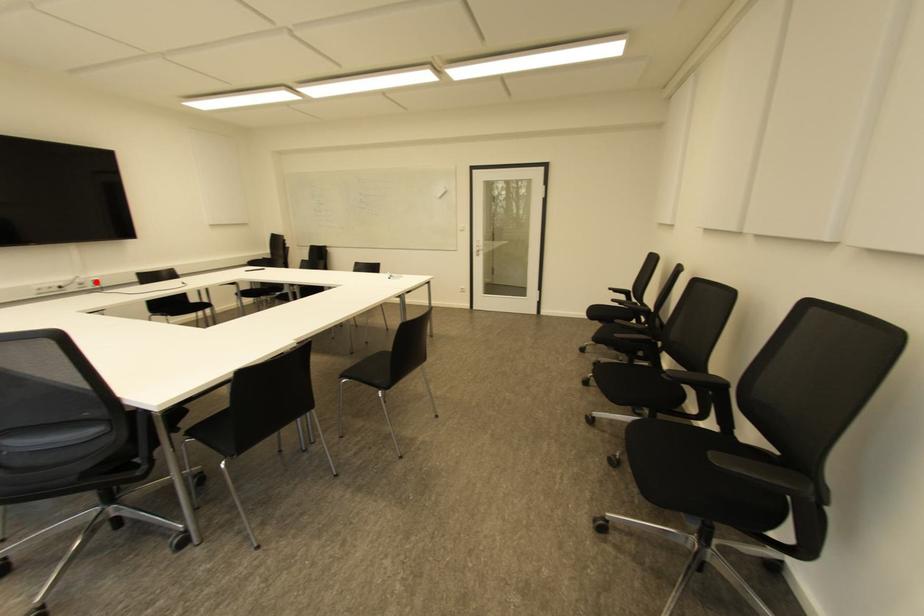
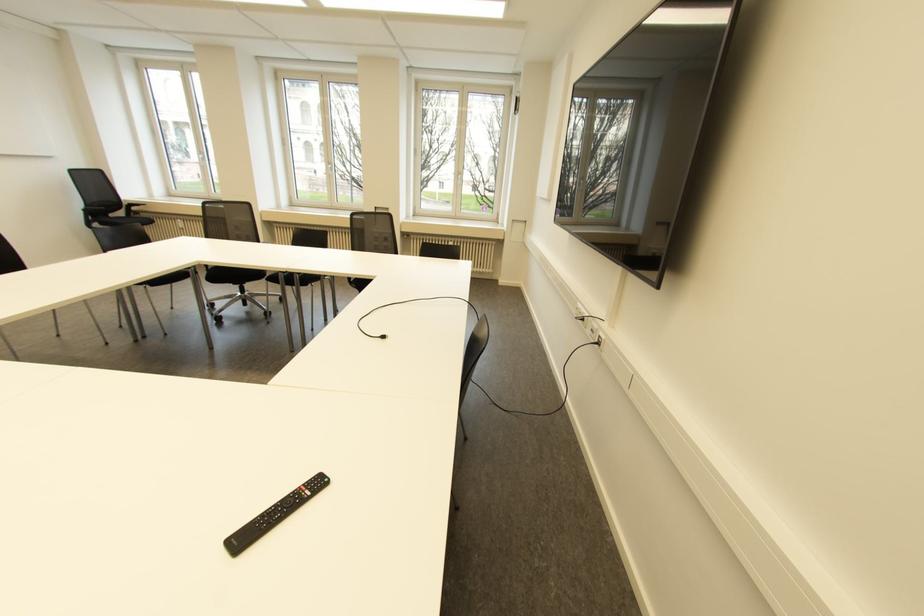
Question: I am providing you with two images of the same scene from different viewpoints. A red point is shown in image1. For the corresponding object point in image2, is it positioned nearer or farther from the camera?

Choices:
 (A) Nearer
 (B) Farther

Answer: (A)